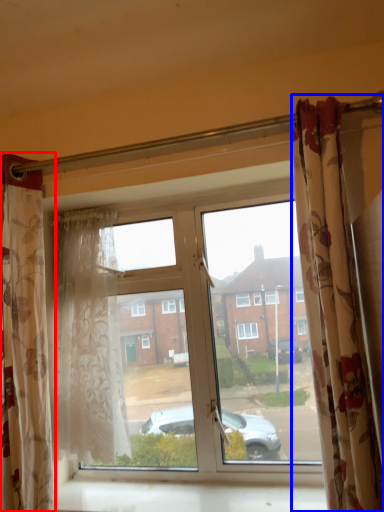
Question: Which of the following is the closest to the observer, curtain (highlighted by a red box) or curtain (highlighted by a blue box)?

Choices:
 (A) curtain
 (B) curtain

Answer: (B)